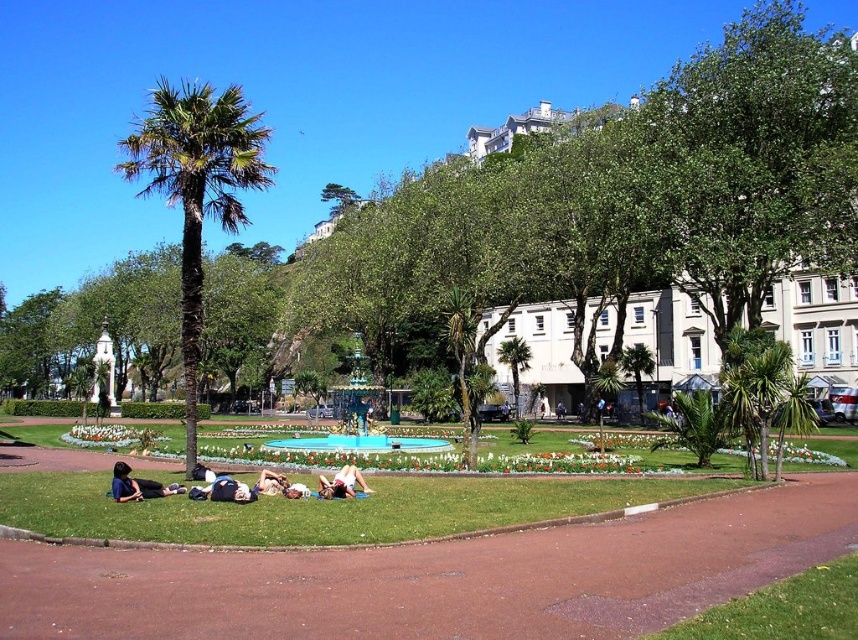
Question: Estimate the real-world distances between objects in this image. Which object is farther from the dark blue fabric at lower left?

Choices:
 (A) white cotton shirt at center
 (B) green leafy palm tree at left
 (C) green leafy palm tree at center

Answer: (B)

Question: Is dark blue fabric at lower left bigger than green leafy palm tree at center?

Choices:
 (A) yes
 (B) no

Answer: (B)

Question: Does white cotton shirt at center have a larger size compared to white fabric person at center?

Choices:
 (A) no
 (B) yes

Answer: (A)

Question: Which point is closer to the camera taking this photo?

Choices:
 (A) (242, 184)
 (B) (384, 451)
 (C) (275, 474)

Answer: (C)

Question: Does green leafy palm tree at center appear on the left side of white cotton shirt at center?

Choices:
 (A) no
 (B) yes

Answer: (A)

Question: Among these objects, which one is farthest from the camera?

Choices:
 (A) green leafy palm tree at center
 (B) dark blue fabric at lower left
 (C) white cotton shirt at center
 (D) blue glass pool at center

Answer: (A)